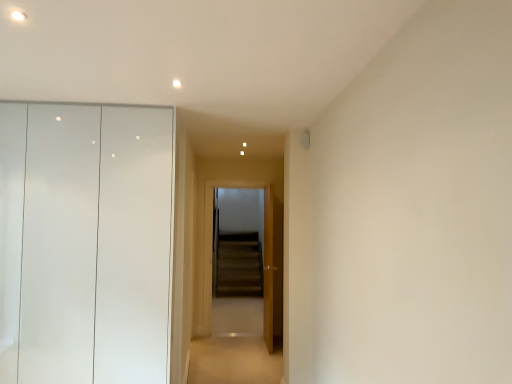
Find the location of a particular element. wooden door at center is located at coordinates (272, 267).

Find the location of `matte white dresser at left`. matte white dresser at left is located at coordinates (85, 243).

In the scene shown: What is the approximate height of matte white dresser at left?

matte white dresser at left is 6.90 feet in height.

The width and height of the screenshot is (512, 384). What are the coordinates of `wooden screen door at center` in the screenshot? It's located at (238, 242).

Consider the image. Does carpeted floor at center have a larger size compared to wooden door at center?

No.

Does carpeted floor at center turn towards wooden door at center?

No, carpeted floor at center is not facing towards wooden door at center.

From a real-world perspective, which object rests below the other?

In real-world perspective, carpeted floor at center is lower.

From the image's perspective, is carpeted floor at center above wooden door at center?

Actually, carpeted floor at center appears below wooden door at center in the image.

Choose the correct answer: Is matte white dresser at left inside carpeted floor at center or outside it?

The correct answer is: outside.

Is matte white dresser at left facing towards carpeted floor at center?

No, matte white dresser at left is not facing towards carpeted floor at center.

Considering the positions of objects matte white dresser at left and carpeted floor at center in the image provided, who is more to the right, matte white dresser at left or carpeted floor at center?

From the viewer's perspective, carpeted floor at center appears more on the right side.

Is matte white dresser at left positioned in front of carpeted floor at center?

That is True.

From a real-world perspective, which object stands above the other?

matte white dresser at left.

Which is in front, matte white dresser at left or wooden door at center?

matte white dresser at left is more forward.

Can you confirm if matte white dresser at left is positioned to the left of wooden door at center?

Yes, matte white dresser at left is to the left of wooden door at center.

Who is taller, matte white dresser at left or wooden door at center?

Standing taller between the two is matte white dresser at left.

From a real-world perspective, is matte white dresser at left positioned above or below wooden screen door at center?

matte white dresser at left is above wooden screen door at center.

Considering the relative sizes of matte white dresser at left and wooden screen door at center in the image provided, is matte white dresser at left shorter than wooden screen door at center?

No.

Which is more to the right, matte white dresser at left or wooden screen door at center?

wooden screen door at center is more to the right.

Does point (59, 138) appear closer or farther from the camera than point (223, 267)?

Point (59, 138) is positioned closer to the camera compared to point (223, 267).

Is the surface of wooden door at center in direct contact with carpeted floor at center?

No, wooden door at center is not making contact with carpeted floor at center.

Between wooden door at center and carpeted floor at center, which one is positioned in front?

Positioned in front is carpeted floor at center.

Measure the distance between wooden door at center and carpeted floor at center.

wooden door at center is 25.30 inches away from carpeted floor at center.

Find the location of a particular element. path on the left of wooden door at center is located at coordinates pyautogui.click(x=234, y=361).

What's the angular difference between wooden screen door at center and wooden door at center's facing directions?

93.8 degrees.

Where is `door below the wooden screen door at center (from the image's perspective)`? This screenshot has width=512, height=384. door below the wooden screen door at center (from the image's perspective) is located at coordinates (272, 267).

Considering the relative sizes of wooden screen door at center and wooden door at center in the image provided, is wooden screen door at center wider than wooden door at center?

Incorrect, the width of wooden screen door at center does not surpass that of wooden door at center.

From a real-world perspective, is wooden screen door at center beneath wooden door at center?

Incorrect, from a real-world perspective, wooden screen door at center is higher than wooden door at center.

Does wooden screen door at center come behind matte white dresser at left?

Yes, it is.

Does wooden screen door at center touch matte white dresser at left?

No, wooden screen door at center is not in contact with matte white dresser at left.

From a real-world perspective, is wooden screen door at center above or below matte white dresser at left?

In terms of real-world spatial position, wooden screen door at center is below matte white dresser at left.

Considering the positions of points (232, 237) and (132, 221), is point (232, 237) closer to camera compared to point (132, 221)?

No, it is not.

Where is `door to the right of carpeted floor at center`? door to the right of carpeted floor at center is located at coordinates (272, 267).

Where is `path behind the matte white dresser at left`? path behind the matte white dresser at left is located at coordinates (234, 361).

Estimate the real-world distances between objects in this image. Which object is further from carpeted floor at center, matte white dresser at left or wooden door at center?

matte white dresser at left.

In the scene shown: Which object lies nearer to the anchor point wooden door at center, wooden screen door at center or matte white dresser at left?

matte white dresser at left is positioned closer to the anchor wooden door at center.

Looking at the image, which one is located further to carpeted floor at center, matte white dresser at left or wooden screen door at center?

wooden screen door at center is positioned further to the anchor carpeted floor at center.

Estimate the real-world distances between objects in this image. Which object is further from matte white dresser at left, wooden door at center or carpeted floor at center?

The object further to matte white dresser at left is carpeted floor at center.

Which object lies further to the anchor point matte white dresser at left, wooden screen door at center or wooden door at center?

wooden screen door at center lies further to matte white dresser at left than the other object.

Considering their positions, is wooden door at center positioned closer to matte white dresser at left than wooden screen door at center?

Among the two, wooden door at center is located nearer to matte white dresser at left.

Based on their spatial positions, is matte white dresser at left or wooden screen door at center further from wooden door at center?

Based on the image, wooden screen door at center appears to be further to wooden door at center.

Looking at the image, which one is located further to carpeted floor at center, wooden door at center or matte white dresser at left?

matte white dresser at left is further to carpeted floor at center.

The height and width of the screenshot is (384, 512). In order to click on path between matte white dresser at left and wooden door at center in the front-back direction in this screenshot , I will do `click(234, 361)`.

Where is `door positioned between matte white dresser at left and wooden screen door at center from near to far`? This screenshot has height=384, width=512. door positioned between matte white dresser at left and wooden screen door at center from near to far is located at coordinates (x=272, y=267).

The height and width of the screenshot is (384, 512). I want to click on door between carpeted floor at center and wooden screen door at center from front to back, so click(272, 267).

Find the location of a particular element. The height and width of the screenshot is (384, 512). path between matte white dresser at left and wooden screen door at center in the front-back direction is located at coordinates (234, 361).